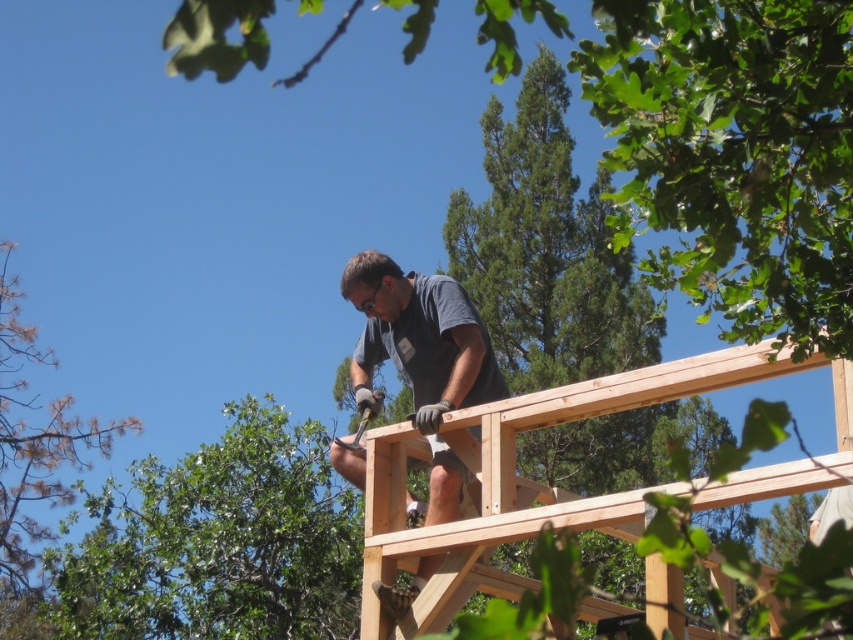
From the picture: How far apart are dark gray shirt at center and brown wood tree at left?

dark gray shirt at center and brown wood tree at left are 62.76 meters apart from each other.

Is dark gray shirt at center bigger than brown wood tree at left?

Actually, dark gray shirt at center might be smaller than brown wood tree at left.

Who is more distant from viewer, [425,300] or [30,538]?

Positioned behind is point [30,538].

Image resolution: width=853 pixels, height=640 pixels. In order to click on dark gray shirt at center in this screenshot , I will do `click(421, 362)`.